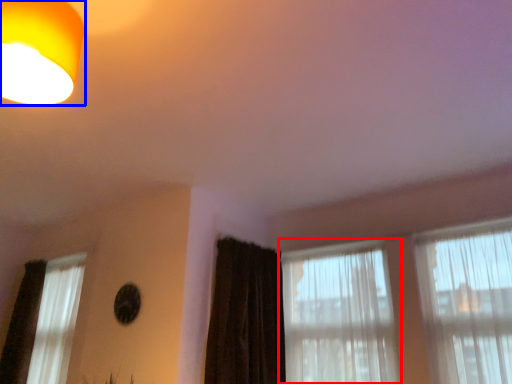
Question: Which object is further to the camera taking this photo, window (highlighted by a red box) or lamp (highlighted by a blue box)?

Choices:
 (A) window
 (B) lamp

Answer: (A)